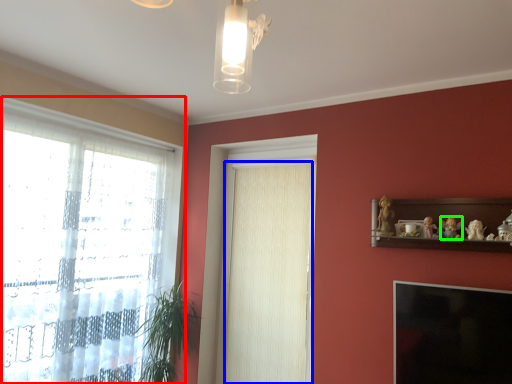
Question: Considering the real-world distances, which object is closest to window (highlighted by a red box)? curtain (highlighted by a blue box) or toy (highlighted by a green box).

Choices:
 (A) curtain
 (B) toy

Answer: (A)